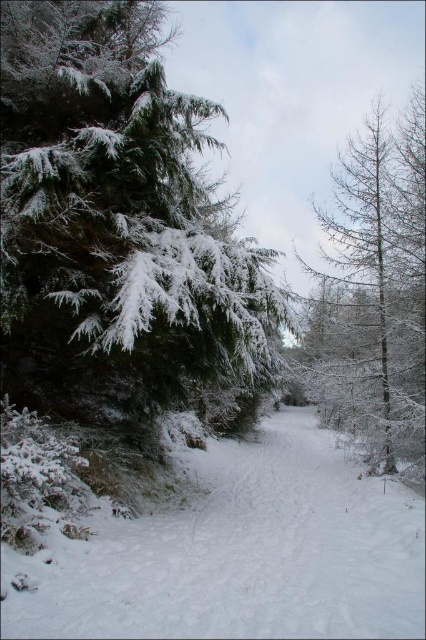
You are standing at the point marked as point (x=244, y=554) in the winter forest scene. Based on the description, what is under your feet?

The point (x=244, y=554) is on white fluffy snow at center, so you are standing on white fluffy snow at center.